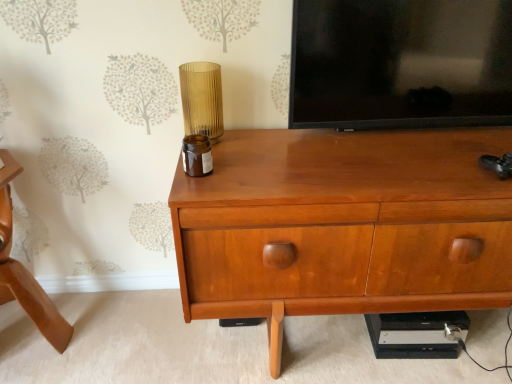
This screenshot has width=512, height=384. Find the location of `vacant space in wooden chest of drawers at center (from a real-world perspective)`. vacant space in wooden chest of drawers at center (from a real-world perspective) is located at coordinates (358, 345).